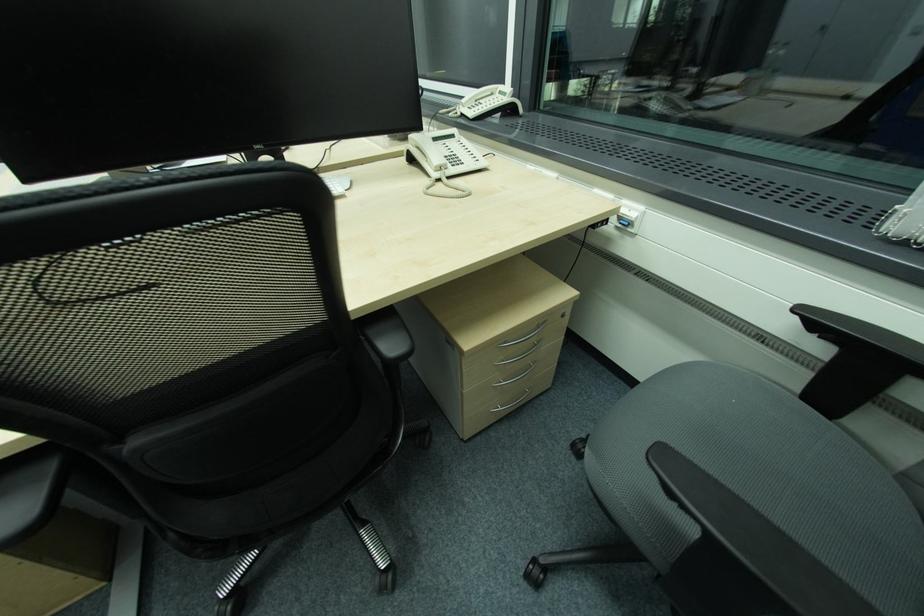
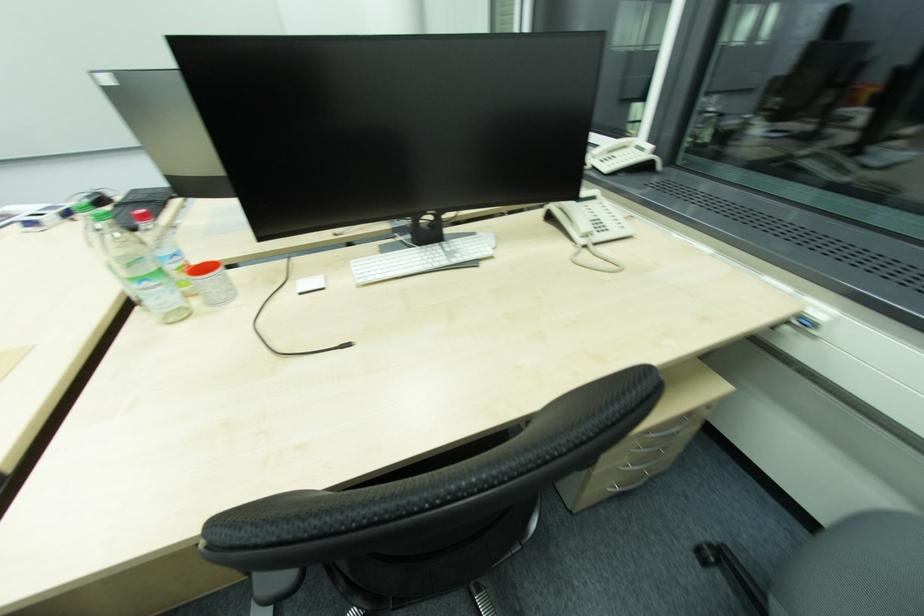
Question: The camera is either moving clockwise (left) or counter-clockwise (right) around the object. The first image is from the beginning of the video and the second image is from the end. Is the camera moving left or right when shooting the video?

Choices:
 (A) Left
 (B) Right

Answer: (B)